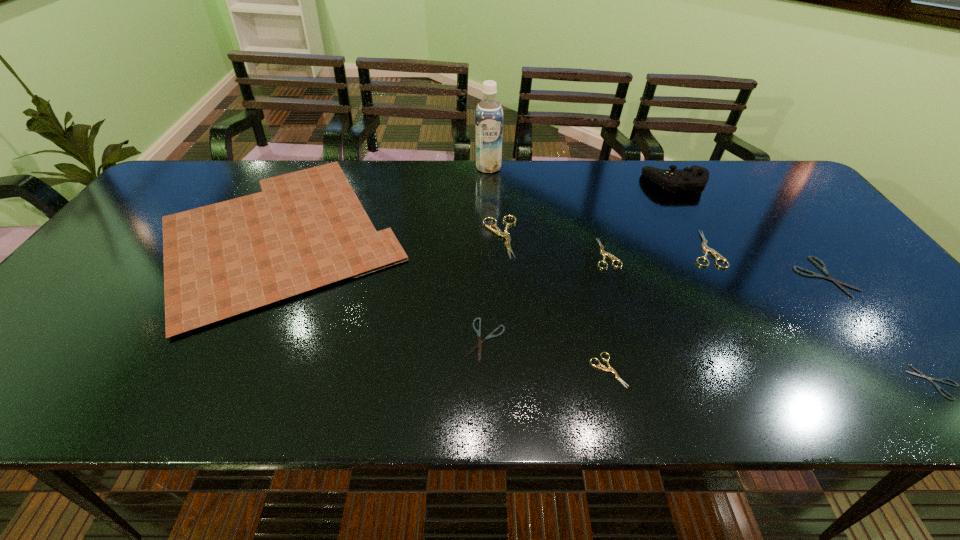
At what (x,y) coordinates should I click in order to perform the action: click on soya milk. Please return your answer as a coordinate pair (x, y). Image resolution: width=960 pixels, height=540 pixels. Looking at the image, I should click on (489, 114).

The image size is (960, 540). Identify the location of the second tallest object. (695, 178).

Find the location of a particular element. The width and height of the screenshot is (960, 540). gameboard is located at coordinates (306, 229).

Where is `the third tallest object`? The image size is (960, 540). the third tallest object is located at coordinates (306, 229).

Image resolution: width=960 pixels, height=540 pixels. Find the location of `the fourth tallest object`. the fourth tallest object is located at coordinates (505, 234).

Find the location of a particular element. The image size is (960, 540). the tallest shears is located at coordinates (505, 234).

Image resolution: width=960 pixels, height=540 pixels. Identify the location of the third smallest beige shears. (706, 249).

Image resolution: width=960 pixels, height=540 pixels. Identify the location of the sixth shortest object. (706, 249).

Identify the location of the sixth object from left to right. The height and width of the screenshot is (540, 960). (603, 253).

Locate an element on the screen. the fourth shears from right to left is located at coordinates (603, 253).